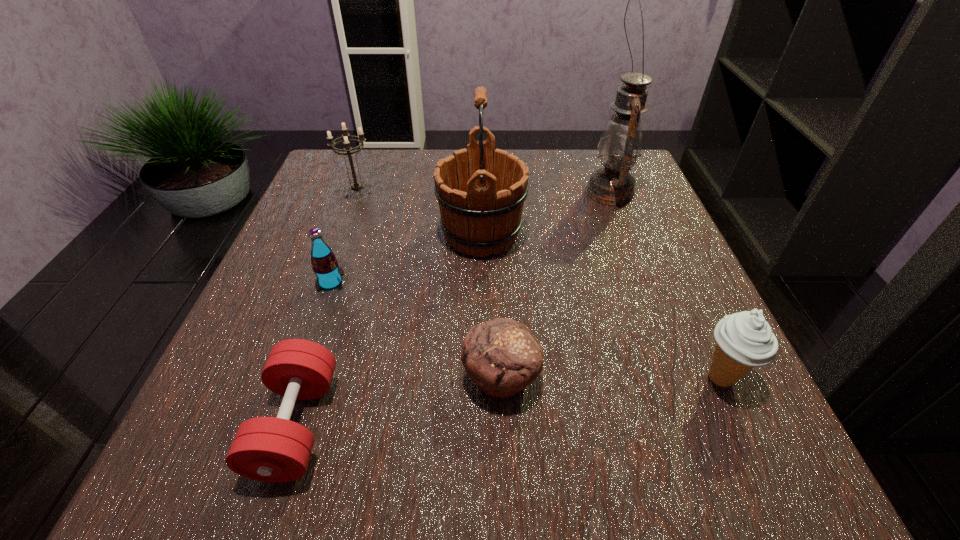
Identify the location of empty space between the wine bucket and the muffin. The image size is (960, 540). (492, 305).

You are a GUI agent. You are given a task and a screenshot of the screen. Output one action in this format:
    pyautogui.click(x=<x>, y=<y>)
    Task: Click on the unoccupied area between the dumbbell and the candle holder
    
    Given the screenshot: What is the action you would take?
    pyautogui.click(x=327, y=309)

Find the location of a particular element. The height and width of the screenshot is (540, 960). free area in between the muffin and the second tallest object is located at coordinates (492, 305).

Find the location of a particular element. Image resolution: width=960 pixels, height=540 pixels. blank region between the dumbbell and the muffin is located at coordinates (398, 401).

In order to click on free area in between the sixth shortest object and the muffin in this screenshot , I will do `click(492, 305)`.

Locate an element on the screen. free space between the candle holder and the wine bucket is located at coordinates (420, 214).

The image size is (960, 540). I want to click on blank region between the candle holder and the second tallest object, so click(x=420, y=214).

Where is `vacant point located between the tallest object and the muffin`? vacant point located between the tallest object and the muffin is located at coordinates (556, 285).

In order to click on object that is the sixth nearest to the soda in this screenshot , I will do `click(745, 340)`.

Identify which object is the sixth closest to the tallest object. Please provide its 2D coordinates. Your answer should be formatted as a tuple, i.e. [(x, y)], where the tuple contains the x and y coordinates of a point satisfying the conditions above.

[(269, 449)]